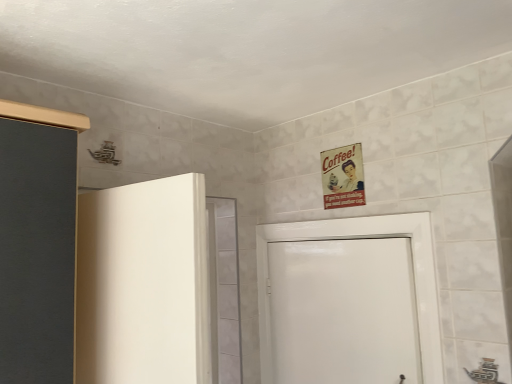
Question: Is white glossy door at center in front of or behind metallic vintage poster at upper center in the image?

Choices:
 (A) behind
 (B) front

Answer: (B)

Question: From the image's perspective, is white glossy door at center positioned above or below metallic vintage poster at upper center?

Choices:
 (A) above
 (B) below

Answer: (B)

Question: From a real-world perspective, relative to metallic vintage poster at upper center, is white glossy door at center vertically above or below?

Choices:
 (A) below
 (B) above

Answer: (A)

Question: In the image, is metallic vintage poster at upper center on the left side or the right side of white glossy door at center?

Choices:
 (A) right
 (B) left

Answer: (A)

Question: Looking at the image, does metallic vintage poster at upper center seem bigger or smaller compared to white glossy door at center?

Choices:
 (A) small
 (B) big

Answer: (A)

Question: From a real-world perspective, is metallic vintage poster at upper center positioned above or below white glossy door at center?

Choices:
 (A) above
 (B) below

Answer: (A)

Question: From the image's perspective, is metallic vintage poster at upper center located above or below white glossy door at center?

Choices:
 (A) above
 (B) below

Answer: (A)